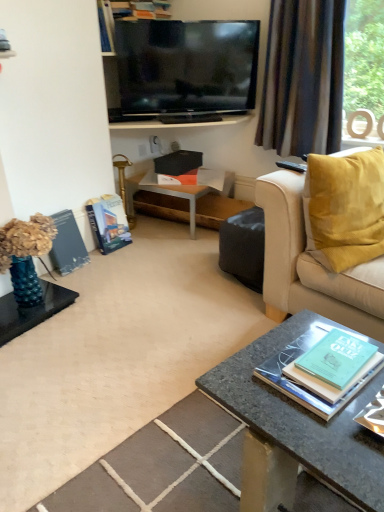
Question: Considering the relative sizes of green matte book at lower right, positioned as the 1th book in front-to-back order, and flat-screen tv at upper center in the image provided, is green matte book at lower right, positioned as the 1th book in front-to-back order, shorter than flat-screen tv at upper center?

Choices:
 (A) no
 (B) yes

Answer: (B)

Question: Is green matte book at lower right, placed as the second book when sorted from left to right, at the left side of flat-screen tv at upper center?

Choices:
 (A) no
 (B) yes

Answer: (A)

Question: Is green matte book at lower right, which is counted as the 2th book, starting from the back, wider than flat-screen tv at upper center?

Choices:
 (A) no
 (B) yes

Answer: (B)

Question: From the image's perspective, is green matte book at lower right, placed as the second book when sorted from left to right, located above flat-screen tv at upper center?

Choices:
 (A) yes
 (B) no

Answer: (B)

Question: From the image's perspective, does green matte book at lower right, the 1th book positioned from the right, appear lower than flat-screen tv at upper center?

Choices:
 (A) no
 (B) yes

Answer: (B)

Question: Is granite coffee table at lower center in front of or behind brown textured curtain at upper right in the image?

Choices:
 (A) behind
 (B) front

Answer: (B)

Question: Is granite coffee table at lower center inside the boundaries of brown textured curtain at upper right, or outside?

Choices:
 (A) inside
 (B) outside

Answer: (B)

Question: Considering the positions of granite coffee table at lower center and brown textured curtain at upper right in the image, is granite coffee table at lower center bigger or smaller than brown textured curtain at upper right?

Choices:
 (A) big
 (B) small

Answer: (B)

Question: From a real-world perspective, relative to brown textured curtain at upper right, is granite coffee table at lower center vertically above or below?

Choices:
 (A) above
 (B) below

Answer: (B)

Question: Is point (278, 349) closer or farther from the camera than point (74, 349)?

Choices:
 (A) closer
 (B) farther

Answer: (A)

Question: Is granite coffee table at lower center wider or thinner than smooth stone coffee table at center?

Choices:
 (A) thin
 (B) wide

Answer: (A)

Question: From the image's perspective, is granite coffee table at lower center positioned above or below smooth stone coffee table at center?

Choices:
 (A) below
 (B) above

Answer: (A)

Question: In terms of size, does granite coffee table at lower center appear bigger or smaller than smooth stone coffee table at center?

Choices:
 (A) big
 (B) small

Answer: (B)

Question: Based on their sizes in the image, would you say brown textured curtain at upper right is bigger or smaller than woodenwoodentable at center?

Choices:
 (A) small
 (B) big

Answer: (B)

Question: Do you think brown textured curtain at upper right is within woodenwoodentable at center, or outside of it?

Choices:
 (A) outside
 (B) inside

Answer: (A)